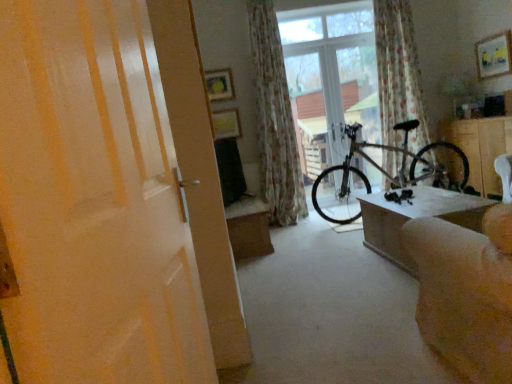
The width and height of the screenshot is (512, 384). I want to click on vacant space that is to the left of wooden coffee table at lower right, the 1th table positioned from the right, so pyautogui.click(x=333, y=269).